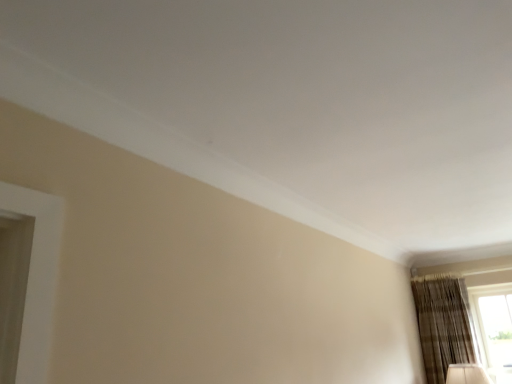
Question: In terms of width, does transparent glass window at lower right look wider or thinner when compared to brown textured curtain at lower right?

Choices:
 (A) wide
 (B) thin

Answer: (B)

Question: From the image's perspective, is transparent glass window at lower right positioned above or below brown textured curtain at lower right?

Choices:
 (A) above
 (B) below

Answer: (B)

Question: Considering the positions of transparent glass window at lower right and brown textured curtain at lower right in the image, is transparent glass window at lower right taller or shorter than brown textured curtain at lower right?

Choices:
 (A) tall
 (B) short

Answer: (B)

Question: In terms of height, does brown textured curtain at lower right look taller or shorter compared to transparent glass window at lower right?

Choices:
 (A) short
 (B) tall

Answer: (B)

Question: From the image's perspective, is brown textured curtain at lower right located above or below transparent glass window at lower right?

Choices:
 (A) below
 (B) above

Answer: (B)

Question: Is brown textured curtain at lower right in front of or behind transparent glass window at lower right in the image?

Choices:
 (A) front
 (B) behind

Answer: (A)

Question: Is brown textured curtain at lower right situated inside transparent glass window at lower right or outside?

Choices:
 (A) inside
 (B) outside

Answer: (B)